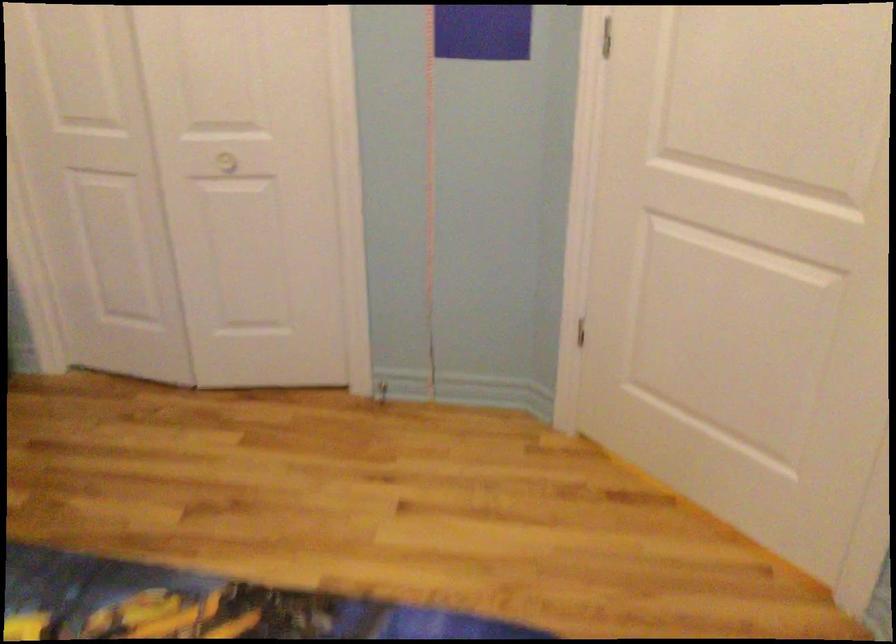
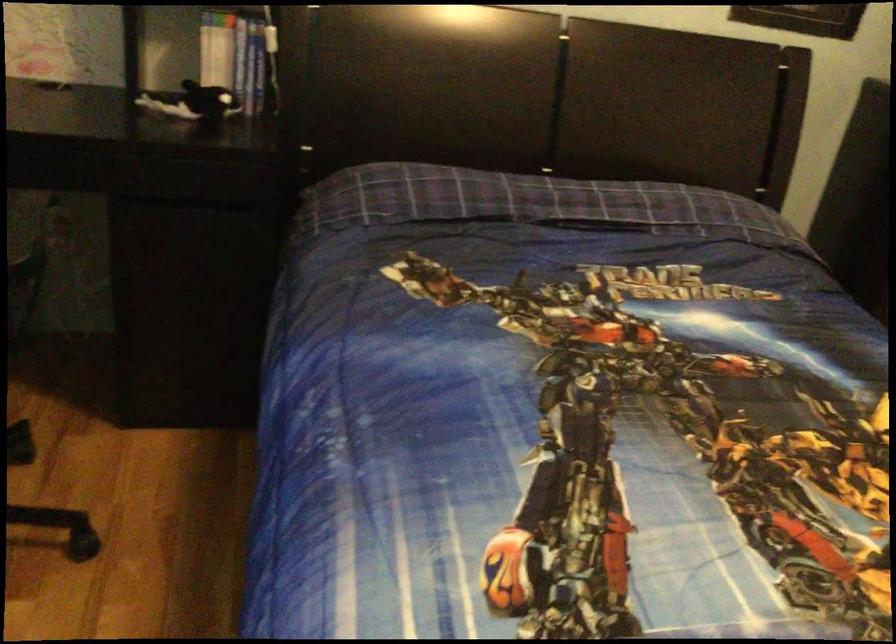
Question: Based on the continuous images, in which direction is the camera rotating? Reply with the corresponding letter.

Choices:
 (A) Left
 (B) Right
 (C) Up
 (D) Down

Answer: (A)